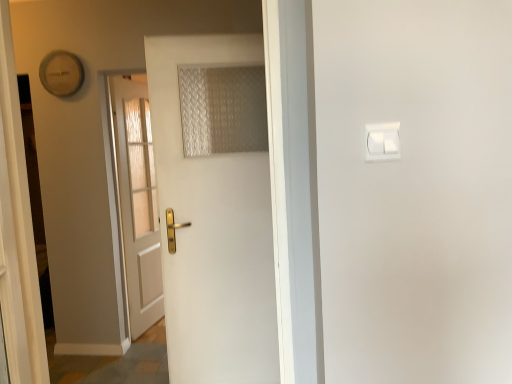
Where is `empty space that is ontop of white wooden door at center, which ranks as the 2th door in right-to-left order (from a real-world perspective)`? The image size is (512, 384). empty space that is ontop of white wooden door at center, which ranks as the 2th door in right-to-left order (from a real-world perspective) is located at coordinates (126, 81).